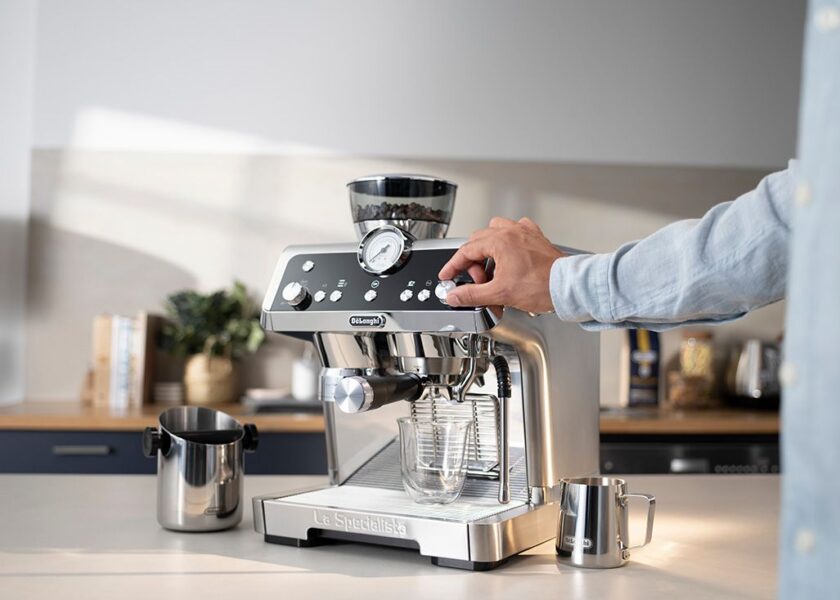
Find the location of a particular element. metal cup is located at coordinates (589, 530).